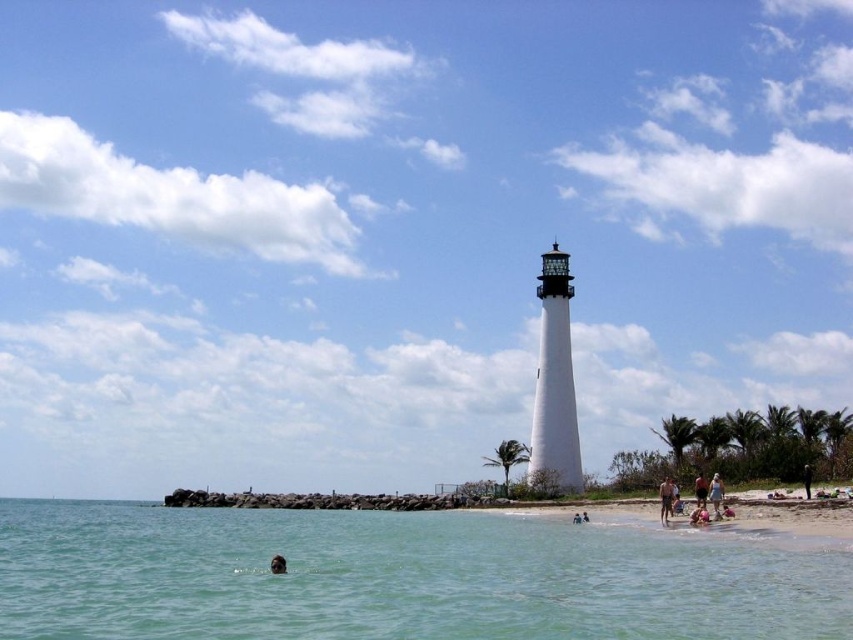
You are a photographer standing on the beach. You want to take a photo of the smooth skin face at lower center without including the tan fabric shorts at lower right in the frame. Is this possible based on their positions?

The tan fabric shorts at lower right is located above the smooth skin face at lower center. Since the shorts are above the face in the image, you can position the camera to exclude the shorts by focusing lower on the smooth skin face at lower center, making it possible to capture the face without the shorts in the frame.

You are a photographer planning to capture a wide shot of the sandy beach at lower right and the black fabric person at lower right. Considering their sizes, which one should you focus on to ensure both are clearly visible in the frame?

The sandy beach at lower right has a larger size compared to the black fabric person at lower right. To ensure both are clearly visible, focus on the larger sandy beach at lower right as the primary subject while positioning the smaller black fabric person at lower right in the foreground or background for balance.